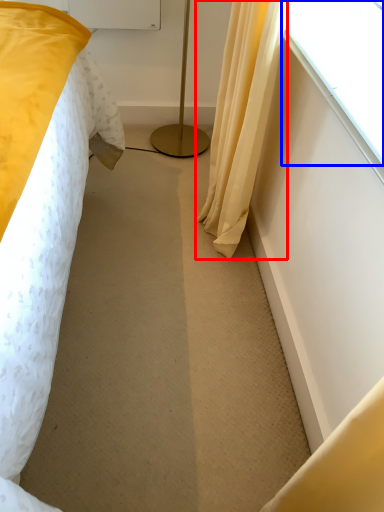
Question: Which of the following is the closest to the observer, curtain (highlighted by a red box) or window (highlighted by a blue box)?

Choices:
 (A) curtain
 (B) window

Answer: (B)